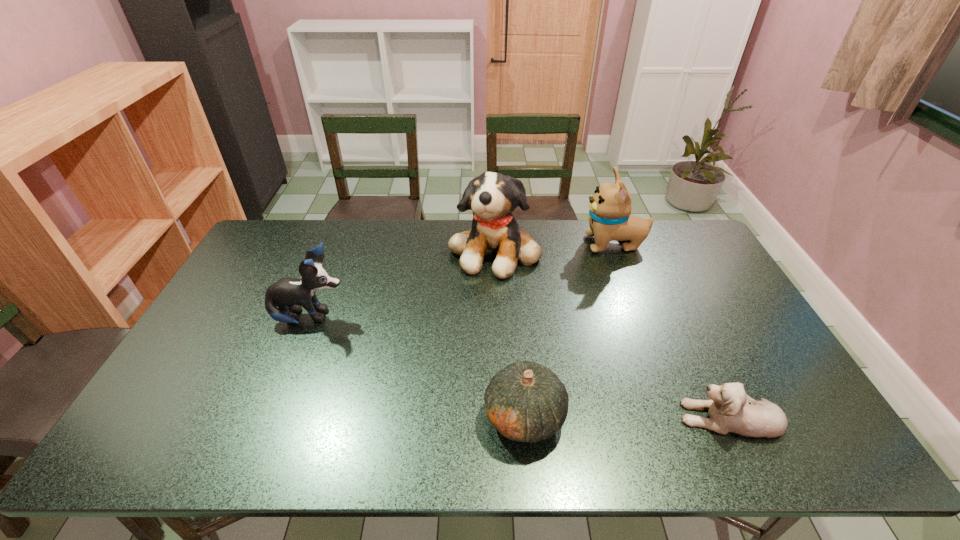
I want to click on the third puppy from right to left, so click(x=492, y=197).

What are the coordinates of `the third farthest object` in the screenshot? It's located at (289, 294).

This screenshot has width=960, height=540. Find the location of `the leftmost puppy`. the leftmost puppy is located at coordinates (289, 294).

Where is `the second shortest object`? This screenshot has width=960, height=540. the second shortest object is located at coordinates (525, 401).

Image resolution: width=960 pixels, height=540 pixels. I want to click on the nearest puppy, so [x=730, y=409].

Find the location of `the shortest object`. the shortest object is located at coordinates (730, 409).

Identify the location of vacant space located 0.140m at the face of the third puppy from right to left. (497, 312).

You are a GUI agent. You are given a task and a screenshot of the screen. Output one action in this format:
    pyautogui.click(x=<x>, y=<y>)
    Task: Click on the vacant area situated 0.340m on the front-facing side of the third farthest puppy
    Image resolution: width=960 pixels, height=540 pixels.
    Given the screenshot: What is the action you would take?
    pyautogui.click(x=462, y=318)

Identify the location of free spot located on the back of the gourd. The image size is (960, 540). (515, 300).

At what (x,y) coordinates should I click in order to perform the action: click on vacant point located on the front-facing side of the shortest object. Please return your answer as a coordinate pair (x, y). Looking at the image, I should click on (526, 417).